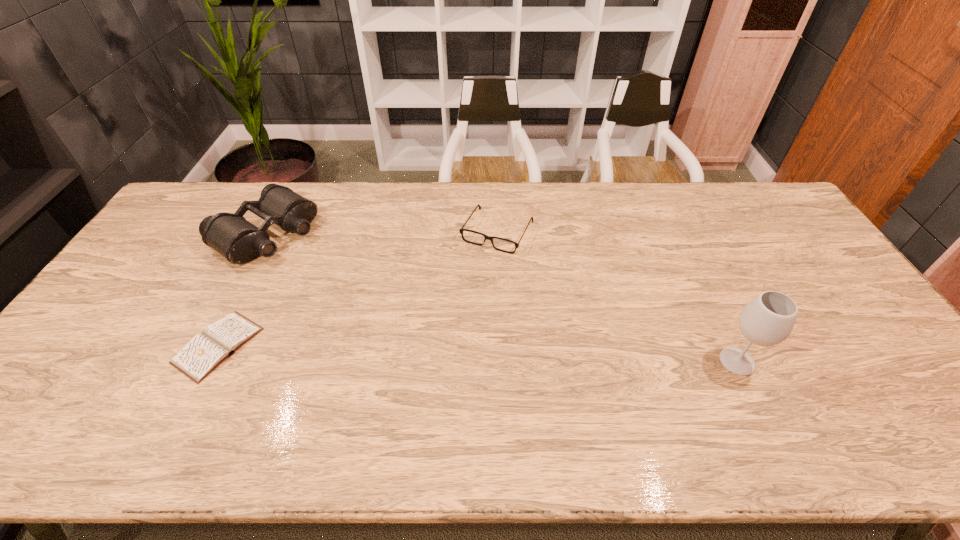
I want to click on the shortest object, so click(203, 353).

The height and width of the screenshot is (540, 960). Identify the location of the tallest object. (768, 319).

Image resolution: width=960 pixels, height=540 pixels. Identify the location of wineglass. (768, 319).

This screenshot has width=960, height=540. Find the location of `spectacles`. spectacles is located at coordinates (461, 230).

This screenshot has width=960, height=540. Identify the location of the second object from right to left. coord(461,230).

In order to click on the third shortest object in this screenshot , I will do `click(239, 241)`.

What are the coordinates of `vacant space positioned 0.110m on the right of the shortest object` in the screenshot? It's located at (300, 346).

The image size is (960, 540). Identify the location of blank space located 0.150m on the right of the wineglass. (817, 361).

This screenshot has width=960, height=540. I want to click on vacant space located 0.330m on the front-facing side of the second object from right to left, so click(x=441, y=332).

What are the coordinates of `vacant position located on the front-facing side of the second object from right to left` in the screenshot? It's located at (445, 324).